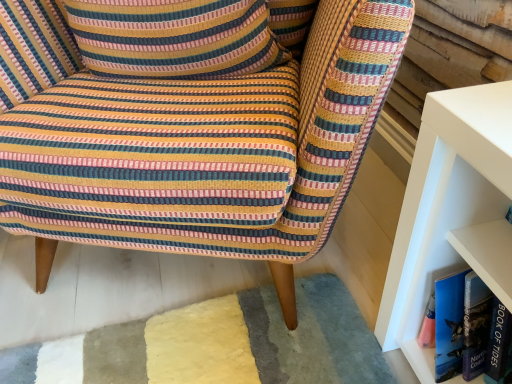
Question: Is blue hardcover book at right touching striped fabric pillow at upper left?

Choices:
 (A) no
 (B) yes

Answer: (A)

Question: From a real-world perspective, is blue hardcover book at right under striped fabric pillow at upper left?

Choices:
 (A) no
 (B) yes

Answer: (B)

Question: Is blue hardcover book at right far away from striped fabric pillow at upper left?

Choices:
 (A) no
 (B) yes

Answer: (A)

Question: Does blue hardcover book at right contain striped fabric pillow at upper left?

Choices:
 (A) yes
 (B) no

Answer: (B)

Question: Is blue hardcover book at right closer to the viewer compared to striped fabric pillow at upper left?

Choices:
 (A) no
 (B) yes

Answer: (B)

Question: Considering the relative positions of blue hardcover book at right and striped fabric pillow at upper left in the image provided, is blue hardcover book at right to the left of striped fabric pillow at upper left from the viewer's perspective?

Choices:
 (A) yes
 (B) no

Answer: (B)

Question: Is striped fabric pillow at upper left shorter than striped fabric chair at center?

Choices:
 (A) yes
 (B) no

Answer: (A)

Question: Is striped fabric chair at center at the back of striped fabric pillow at upper left?

Choices:
 (A) no
 (B) yes

Answer: (B)

Question: Is striped fabric pillow at upper left smaller than striped fabric chair at center?

Choices:
 (A) yes
 (B) no

Answer: (A)

Question: Considering the relative sizes of striped fabric pillow at upper left and striped fabric chair at center in the image provided, is striped fabric pillow at upper left bigger than striped fabric chair at center?

Choices:
 (A) yes
 (B) no

Answer: (B)

Question: From a real-world perspective, is striped fabric pillow at upper left over striped fabric chair at center?

Choices:
 (A) no
 (B) yes

Answer: (B)

Question: Considering the relative sizes of striped fabric pillow at upper left and striped fabric chair at center in the image provided, is striped fabric pillow at upper left thinner than striped fabric chair at center?

Choices:
 (A) no
 (B) yes

Answer: (B)

Question: Considering the relative sizes of striped fabric chair at center and blue hardcover book at right in the image provided, is striped fabric chair at center smaller than blue hardcover book at right?

Choices:
 (A) yes
 (B) no

Answer: (B)